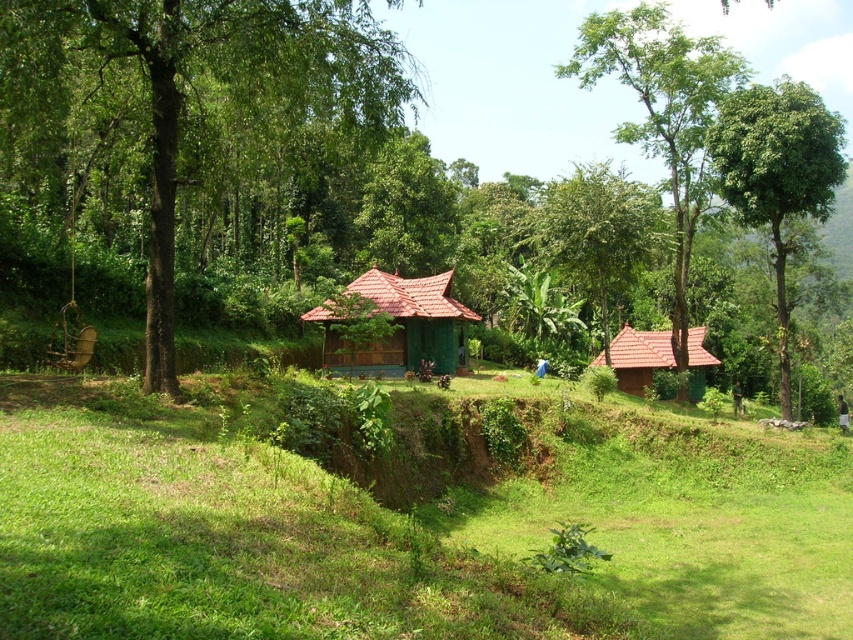
Question: Does green leafy tree at left appear under brown tile hut at center-right?

Choices:
 (A) no
 (B) yes

Answer: (A)

Question: Which object is closer to the camera taking this photo?

Choices:
 (A) green leafy forest at center
 (B) matte green wooden hut at center

Answer: (A)

Question: Which of the following is the farthest from the observer?

Choices:
 (A) matte green wooden hut at center
 (B) green leafy tree at left

Answer: (A)

Question: Does green grassy at lower center appear under green leafy tree at upper center?

Choices:
 (A) yes
 (B) no

Answer: (A)

Question: Which point appears farthest from the camera in this image?

Choices:
 (A) (630, 326)
 (B) (549, 218)
 (C) (293, 170)

Answer: (A)

Question: Considering the relative positions of green grassy at lower center and brown tile hut at center-right in the image provided, where is green grassy at lower center located with respect to brown tile hut at center-right?

Choices:
 (A) above
 (B) below

Answer: (B)